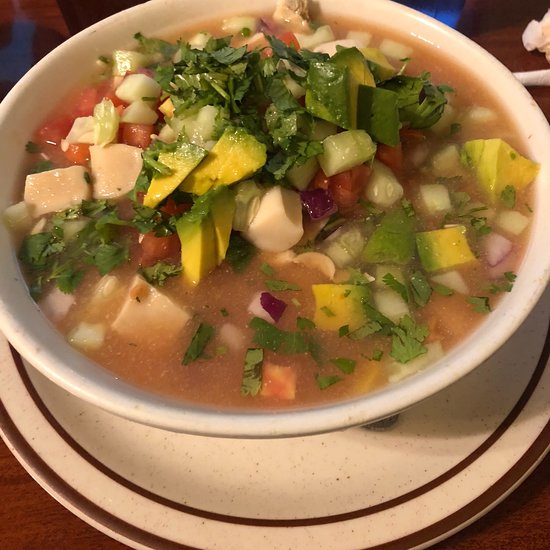
Find the location of `handle`. handle is located at coordinates (526, 73).